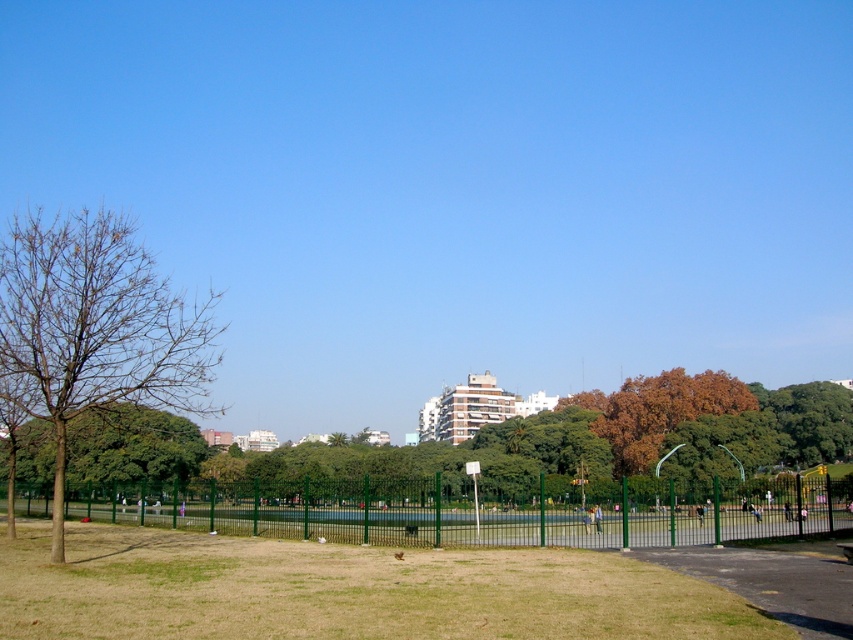
You are standing in the park and want to take a photo of both the green grassy field at lower center and the bare wood tree at left. Which object should you focus on first if you want both to be in clear view?

You should focus on the green grassy field at lower center first because it is closer to the viewer than the bare wood tree at left. By focusing on the closer object, both will be in clear view due to the depth of field.